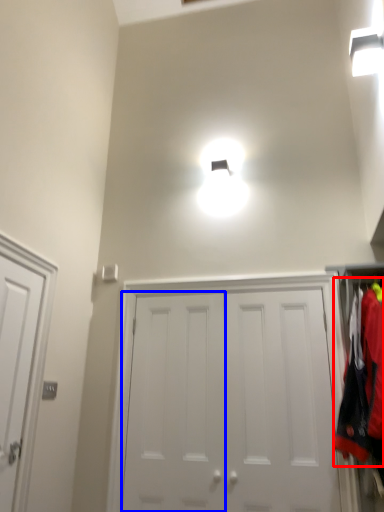
Question: Which object appears closest to the camera in this image, laundry (highlighted by a red box) or door (highlighted by a blue box)?

Choices:
 (A) laundry
 (B) door

Answer: (A)